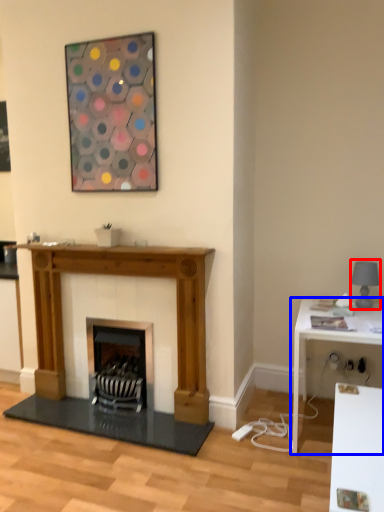
Question: Which object appears farthest to the camera in this image, lamp (highlighted by a red box) or table (highlighted by a blue box)?

Choices:
 (A) lamp
 (B) table

Answer: (A)